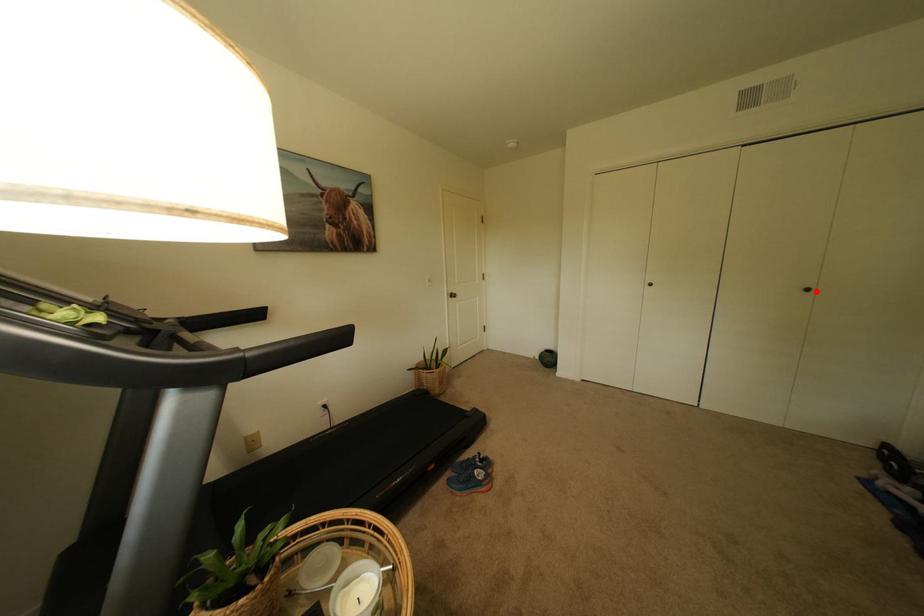
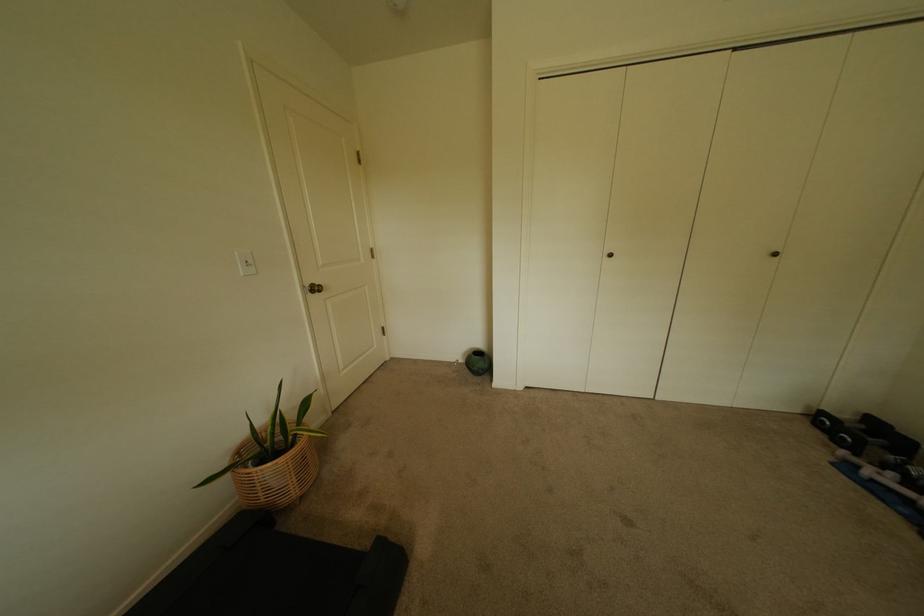
The point at the highlighted location is marked in the first image. Where is the corresponding point in the second image?

(784, 256)